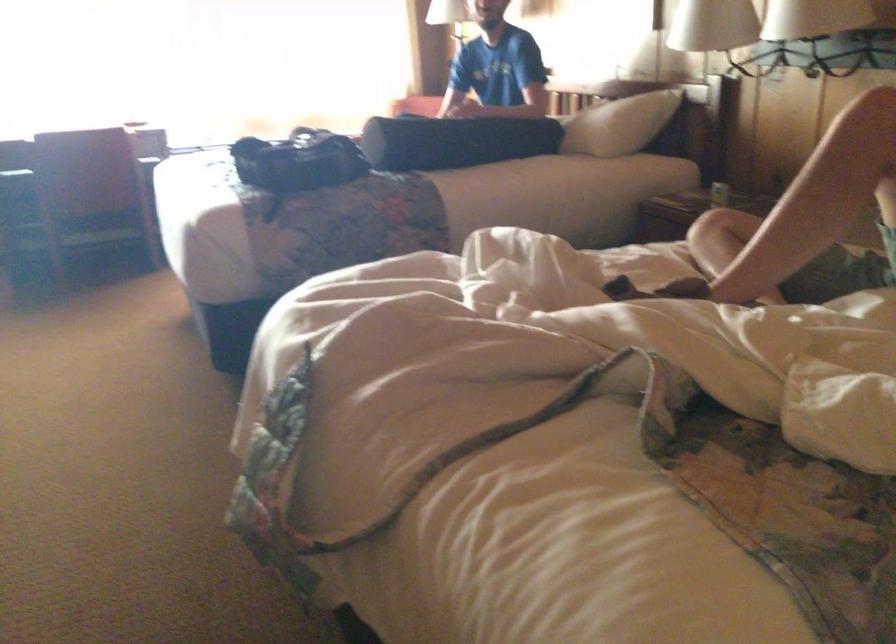
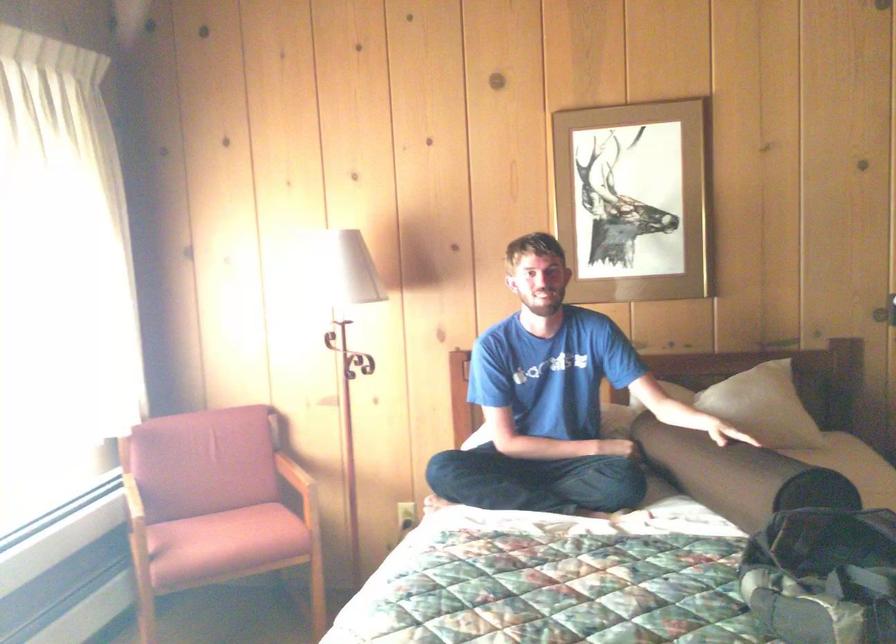
In the second image, find the point that corresponds to point 397,122 in the first image.

(737, 475)